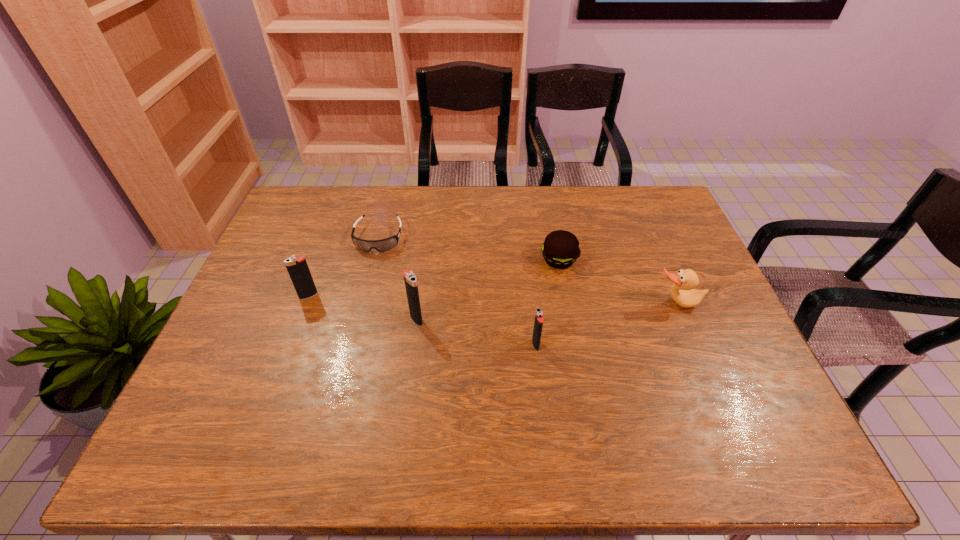
In the image, there is a desktop. Where is `vacant space at the far edge`? The height and width of the screenshot is (540, 960). vacant space at the far edge is located at coordinates (592, 195).

This screenshot has height=540, width=960. I want to click on free space at the near edge of the desktop, so [632, 383].

This screenshot has width=960, height=540. I want to click on vacant region at the left edge of the desktop, so click(291, 231).

Where is `vacant space at the right edge`? vacant space at the right edge is located at coordinates (682, 234).

Where is `free region at the far left corner of the desktop`? The height and width of the screenshot is (540, 960). free region at the far left corner of the desktop is located at coordinates click(x=319, y=201).

At what (x,y) coordinates should I click in order to perform the action: click on vacant space at the near left corner of the desktop. Please return your answer as a coordinate pair (x, y). Image resolution: width=960 pixels, height=540 pixels. Looking at the image, I should click on (226, 409).

Locate an element on the screen. The image size is (960, 540). free point at the far right corner is located at coordinates (644, 194).

Find the location of a particular element. The image size is (960, 540). free point between the rightmost object and the patty is located at coordinates (618, 282).

Where is `vacant area that lies between the fifth object from left to right and the duck`? vacant area that lies between the fifth object from left to right and the duck is located at coordinates (618, 282).

Identify the location of unoccupied area between the second tallest igniter and the duck. (492, 300).